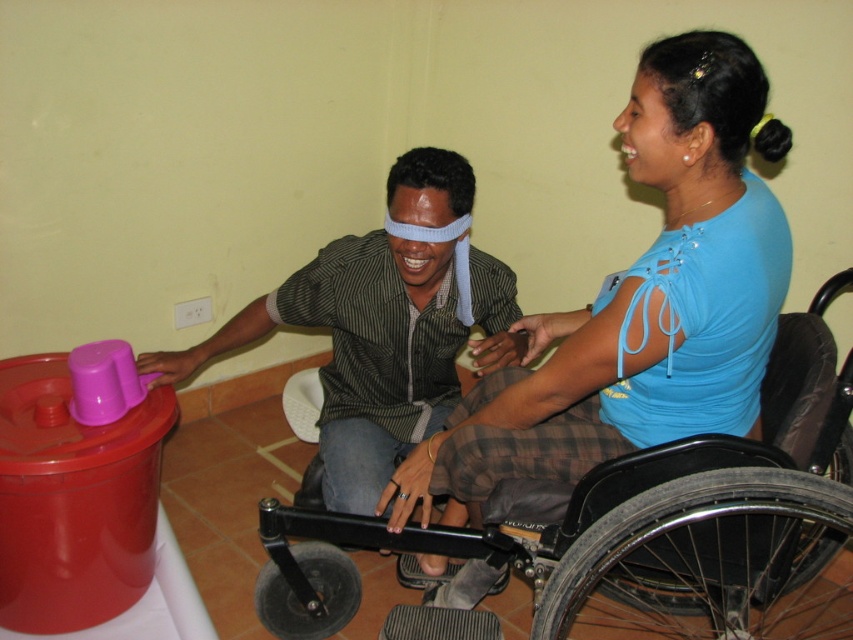
From the picture: You are designing a new accessible space and need to ensure there is enough room for both the black plastic wheelchair at center and the matte black shirt at center. Based on their sizes, which object requires more space in terms of width?

The black plastic wheelchair at center requires more space in terms of width because its width is larger than the matte black shirt at center.